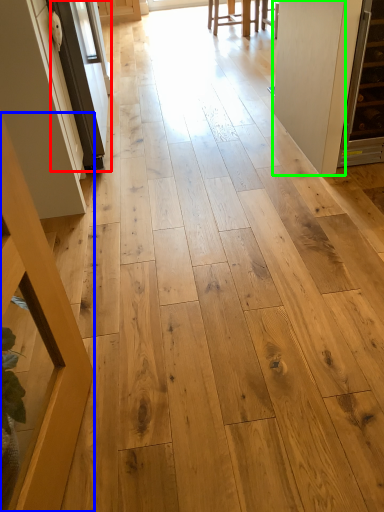
Question: Which object is positioned farthest from screen door (highlighted by a red box)? Select from furniture (highlighted by a blue box) and door (highlighted by a green box).

Choices:
 (A) furniture
 (B) door

Answer: (A)